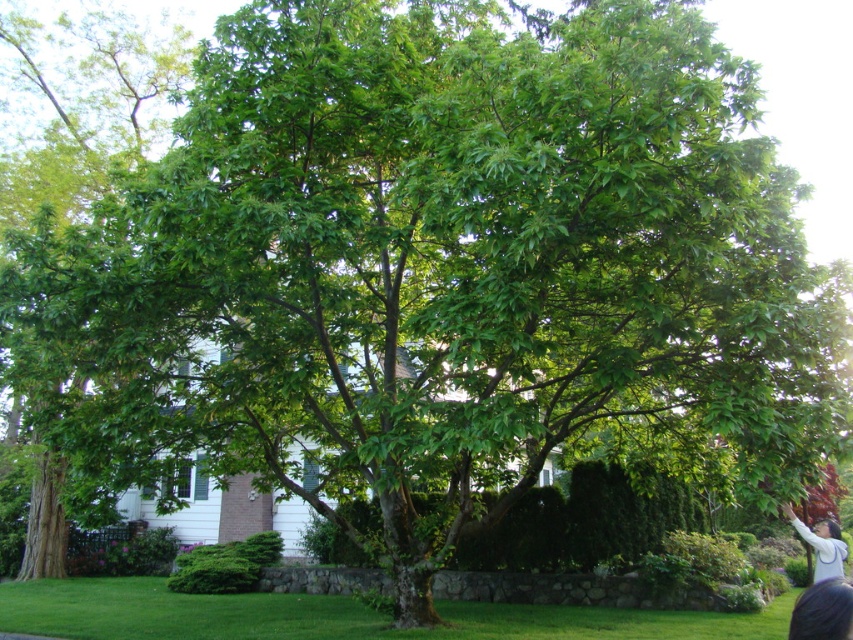
Based on the photo, measure the distance from green grass at lower center to dark brown hair at lower right.

green grass at lower center is 9.91 meters away from dark brown hair at lower right.

Can you confirm if green grass at lower center is positioned below dark brown hair at lower right?

Yes.

Is point (172, 609) in front of point (792, 624)?

No, (172, 609) is behind (792, 624).

Locate an element on the screen. The image size is (853, 640). green grass at lower center is located at coordinates (338, 616).

Does green grass at lower center appear on the left side of light gray sweater at lower right?

Correct, you'll find green grass at lower center to the left of light gray sweater at lower right.

Is green grass at lower center taller than light gray sweater at lower right?

Yes.

Which is in front, point (183, 634) or point (842, 570)?

Point (842, 570) is more forward.

This screenshot has width=853, height=640. Find the location of `green grass at lower center`. green grass at lower center is located at coordinates (338, 616).

Is point (838, 589) farther from viewer compared to point (808, 536)?

That is False.

Which is below, dark brown hair at lower right or light gray sweater at lower right?

light gray sweater at lower right is lower down.

The width and height of the screenshot is (853, 640). Describe the element at coordinates (822, 611) in the screenshot. I see `dark brown hair at lower right` at that location.

Where is `dark brown hair at lower right`? The image size is (853, 640). dark brown hair at lower right is located at coordinates (822, 611).